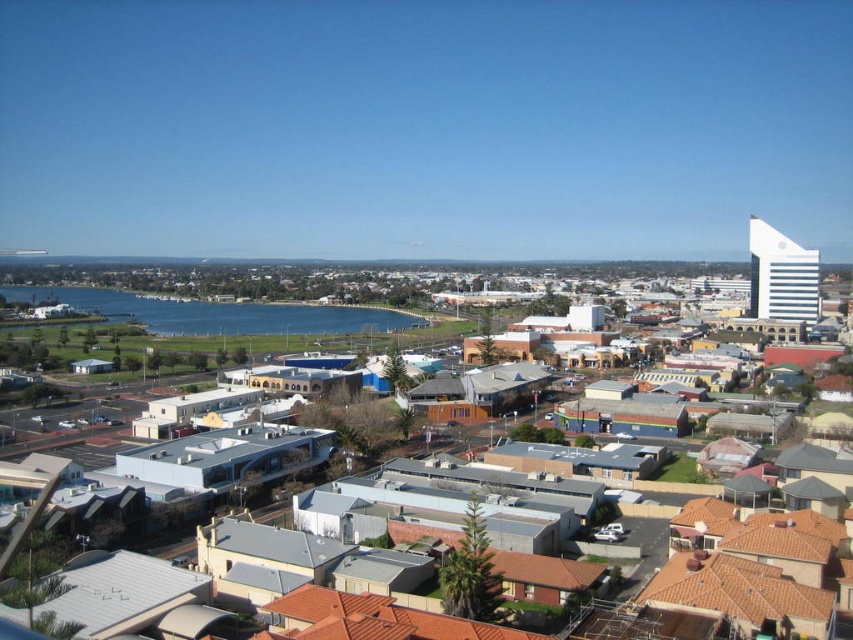
You are a drone operator planning to capture aerial footage of the blue water at center and gray concrete buildings at center. Based on the scene, which object occupies a larger horizontal space in the image?

The blue water at center might be wider than gray concrete buildings at center according to the description.

You are a drone operator tasked with capturing aerial footage of the blue water at center and the gray concrete buildings at center. According to the scene, which object is located above the other?

The blue water at center is positioned over gray concrete buildings at center, meaning the water appears above the buildings in the image due to perspective or reflection.